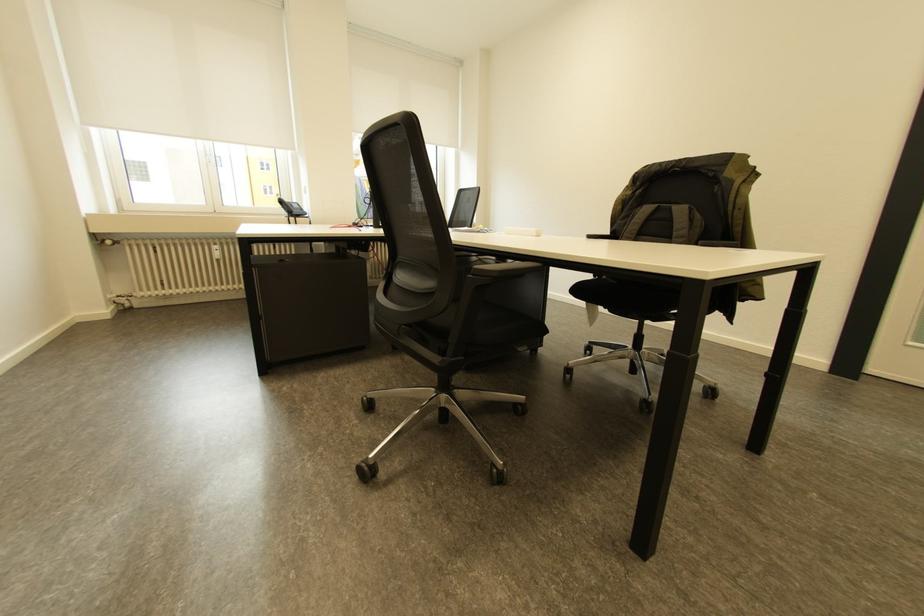
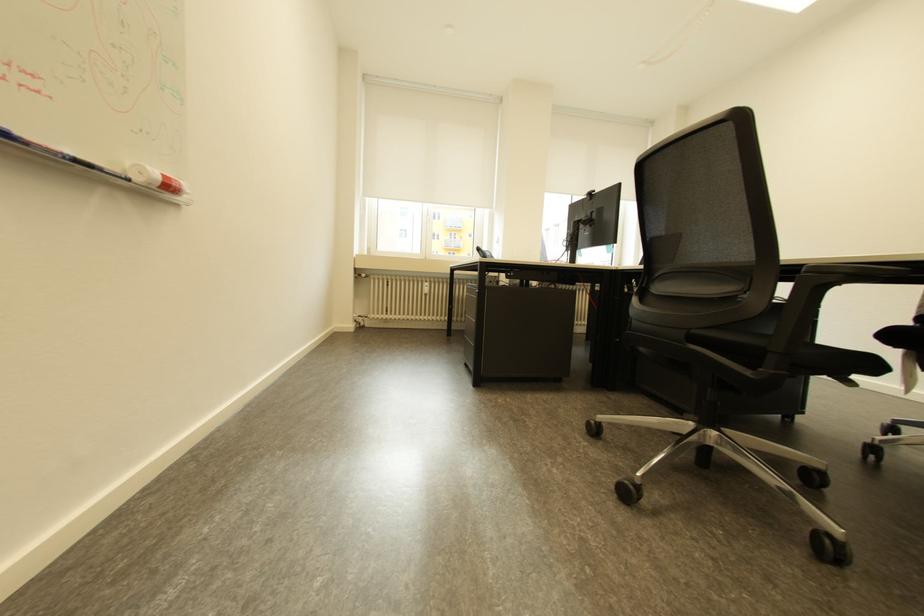
Question: What movement of the cameraman would produce the second image?

Choices:
 (A) Left
 (B) Right
 (C) Forward
 (D) Backward

Answer: (A)